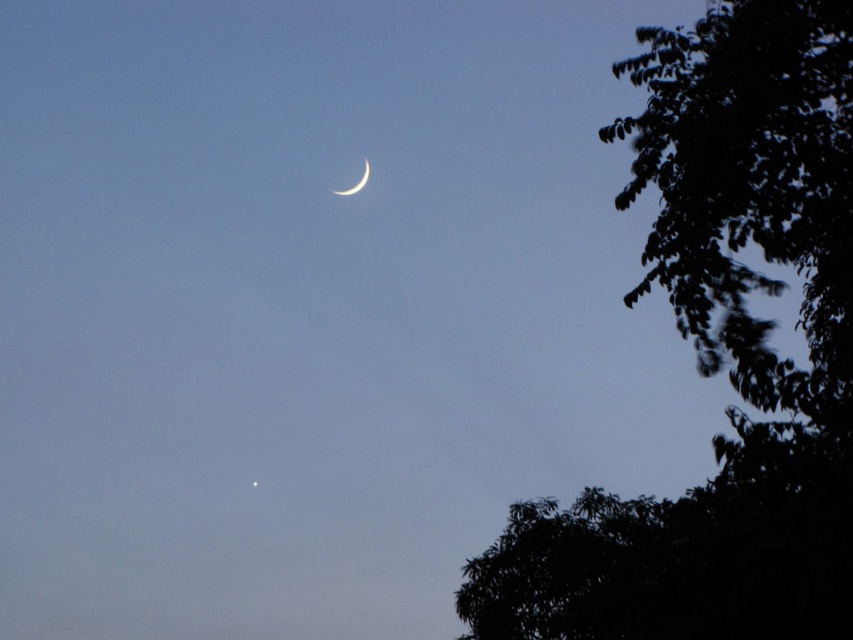
Question: Can you confirm if dark green leafy tree at upper right is wider than satin silver crescent at upper center?

Choices:
 (A) yes
 (B) no

Answer: (A)

Question: Considering the relative positions of dark green leafy tree at upper right and satin silver crescent at upper center in the image provided, where is dark green leafy tree at upper right located with respect to satin silver crescent at upper center?

Choices:
 (A) above
 (B) below

Answer: (B)

Question: Which point appears farthest from the camera in this image?

Choices:
 (A) (807, 134)
 (B) (340, 193)

Answer: (B)

Question: Considering the relative positions of dark green leafy tree at upper right and satin silver crescent at upper center in the image provided, where is dark green leafy tree at upper right located with respect to satin silver crescent at upper center?

Choices:
 (A) below
 (B) above

Answer: (A)